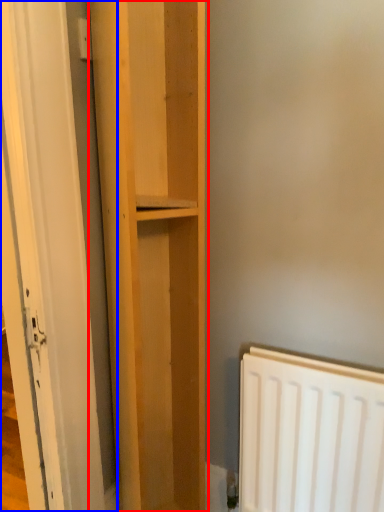
Question: Which of the following is the closest to the observer, cupboard (highlighted by a red box) or door (highlighted by a blue box)?

Choices:
 (A) cupboard
 (B) door

Answer: (B)